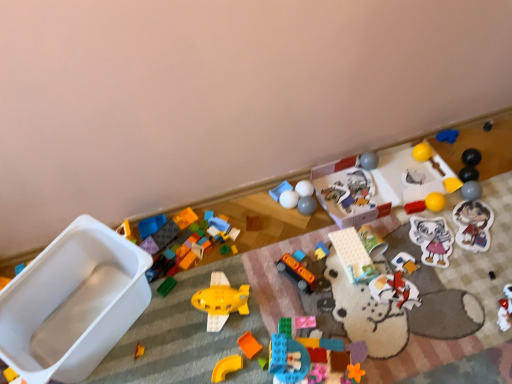
Where is `free space between rubber duck at center, which ranks as the eleventh toy in right-to-left order, and translucent plastic blocks at center, arranged as the 11th toy when viewed from the left`? free space between rubber duck at center, which ranks as the eleventh toy in right-to-left order, and translucent plastic blocks at center, arranged as the 11th toy when viewed from the left is located at coordinates (320, 303).